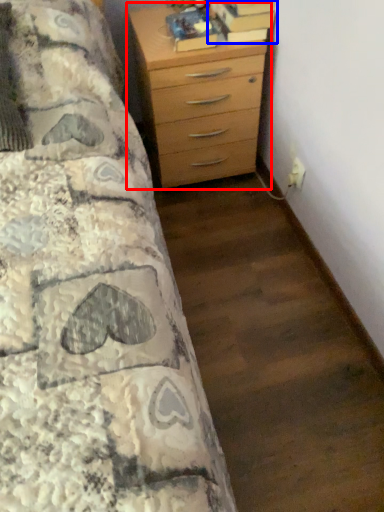
Question: Which object is further to the camera taking this photo, chest of drawers (highlighted by a red box) or book (highlighted by a blue box)?

Choices:
 (A) chest of drawers
 (B) book

Answer: (B)